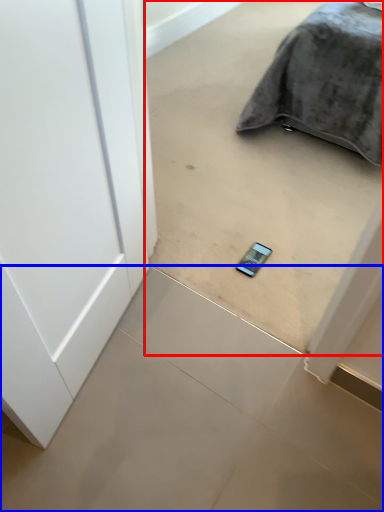
Question: Which object appears farthest to the camera in this image, concrete (highlighted by a red box) or concrete (highlighted by a blue box)?

Choices:
 (A) concrete
 (B) concrete

Answer: (B)